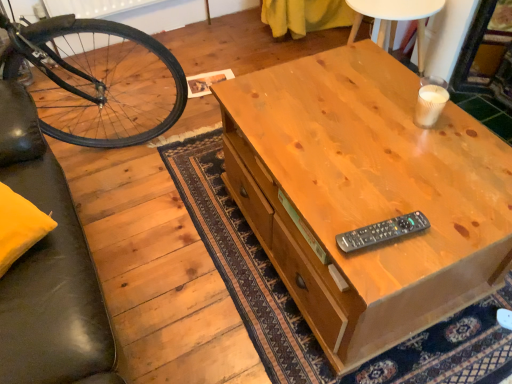
Find the location of a particular element. The height and width of the screenshot is (384, 512). free space in front of white paper cup at upper right is located at coordinates (435, 155).